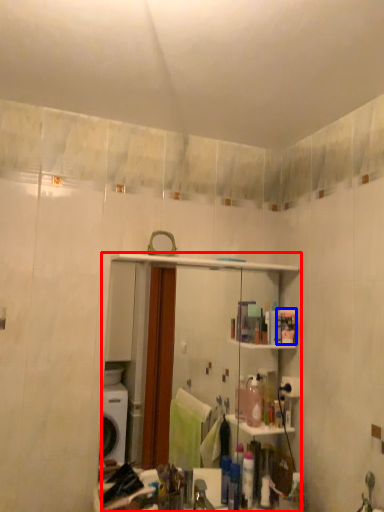
Question: Which object is closer to the camera taking this photo, mirror (highlighted by a red box) or toiletry (highlighted by a blue box)?

Choices:
 (A) mirror
 (B) toiletry

Answer: (A)